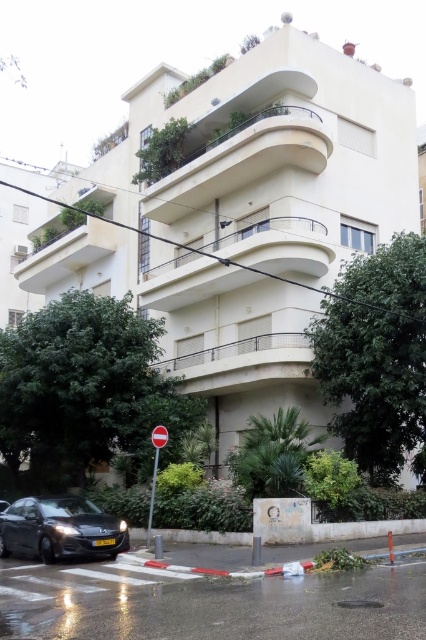
You are standing at the point marked as point (x=146, y=531). You want to walk to the entrance of the building, which is located at the base of the structure. Given that the distance between you and the entrance is 17.82 meters, is this distance shorter than the length of a standard tennis court?

The distance between you and the entrance is 17.82 meters. A standard tennis court is 23.77 meters long. Since 17.82 meters is less than 23.77 meters, the distance to the entrance is shorter than the length of a standard tennis court.

You are a delivery driver trying to park your vehicle in front of the building. The parking space can only accommodate vehicles narrower than the red plastic sign at center. Can your shiny black car at lower left fit into this space?

The shiny black car at lower left is wider than the red plastic sign at center, so it cannot fit into the parking space designed for vehicles narrower than the red plastic sign at center.

You are standing at the base of the residential building and want to reach the entrance. The entrance is located at point (2, 525). Can you walk directly to the entrance from your current position?

The distance between you and point (2, 525) is 53.57 feet, so yes, you can walk directly to the entrance from your current position as there are no obstructions mentioned in the scene description.